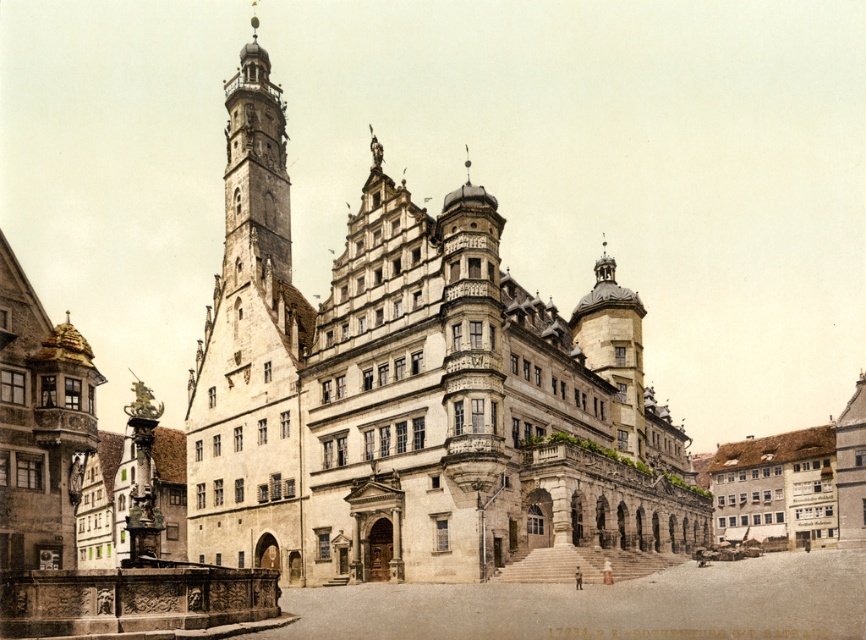
Can you confirm if stone building at center is taller than stone tower at left?

In fact, stone building at center may be shorter than stone tower at left.

Locate an element on the screen. The width and height of the screenshot is (866, 640). stone building at center is located at coordinates (417, 394).